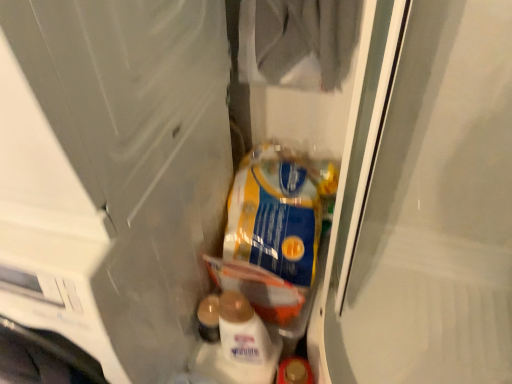
Question: From the image's perspective, is blue/yellow plastic bag at center under transparent plastic screen door at left, marked as the 1th screen door in a left-to-right arrangement?

Choices:
 (A) no
 (B) yes

Answer: (A)

Question: Considering the relative sizes of blue/yellow plastic bag at center and transparent plastic screen door at left, which is the second screen door in right-to-left order, in the image provided, is blue/yellow plastic bag at center smaller than transparent plastic screen door at left, which is the second screen door in right-to-left order,?

Choices:
 (A) no
 (B) yes

Answer: (B)

Question: Is blue/yellow plastic bag at center touching transparent plastic screen door at left, which is the second screen door in right-to-left order?

Choices:
 (A) no
 (B) yes

Answer: (A)

Question: Can you confirm if blue/yellow plastic bag at center is bigger than transparent plastic screen door at left, marked as the 1th screen door in a left-to-right arrangement?

Choices:
 (A) yes
 (B) no

Answer: (B)

Question: Is blue/yellow plastic bag at center outside of transparent plastic screen door at left, marked as the 1th screen door in a left-to-right arrangement?

Choices:
 (A) no
 (B) yes

Answer: (B)

Question: Would you say clear plastic bag at center, acting as the 2th screen door starting from the left, is to the left or to the right of blue/yellow plastic bag at center in the picture?

Choices:
 (A) left
 (B) right

Answer: (B)

Question: From the image's perspective, is clear plastic bag at center, marked as the first screen door in a right-to-left arrangement, above or below blue/yellow plastic bag at center?

Choices:
 (A) below
 (B) above

Answer: (B)

Question: Do you think clear plastic bag at center, marked as the first screen door in a right-to-left arrangement, is within blue/yellow plastic bag at center, or outside of it?

Choices:
 (A) outside
 (B) inside

Answer: (A)

Question: Is clear plastic bag at center, marked as the first screen door in a right-to-left arrangement, taller or shorter than blue/yellow plastic bag at center?

Choices:
 (A) tall
 (B) short

Answer: (A)

Question: Is transparent plastic screen door at left, which is the second screen door in right-to-left order, wider or thinner than clear plastic bag at center, acting as the 2th screen door starting from the left?

Choices:
 (A) thin
 (B) wide

Answer: (B)

Question: From the image's perspective, is transparent plastic screen door at left, which is the second screen door in right-to-left order, located above or below clear plastic bag at center, marked as the first screen door in a right-to-left arrangement?

Choices:
 (A) above
 (B) below

Answer: (B)

Question: Is transparent plastic screen door at left, which is the second screen door in right-to-left order, to the left or to the right of clear plastic bag at center, marked as the first screen door in a right-to-left arrangement, in the image?

Choices:
 (A) right
 (B) left

Answer: (B)

Question: From a real-world perspective, is transparent plastic screen door at left, marked as the 1th screen door in a left-to-right arrangement, positioned above or below clear plastic bag at center, acting as the 2th screen door starting from the left?

Choices:
 (A) above
 (B) below

Answer: (B)

Question: Is transparent plastic screen door at left, marked as the 1th screen door in a left-to-right arrangement, taller or shorter than blue/yellow plastic bag at center?

Choices:
 (A) short
 (B) tall

Answer: (B)

Question: Considering the relative positions of transparent plastic screen door at left, which is the second screen door in right-to-left order, and blue/yellow plastic bag at center in the image provided, is transparent plastic screen door at left, which is the second screen door in right-to-left order, to the left or to the right of blue/yellow plastic bag at center?

Choices:
 (A) left
 (B) right

Answer: (A)